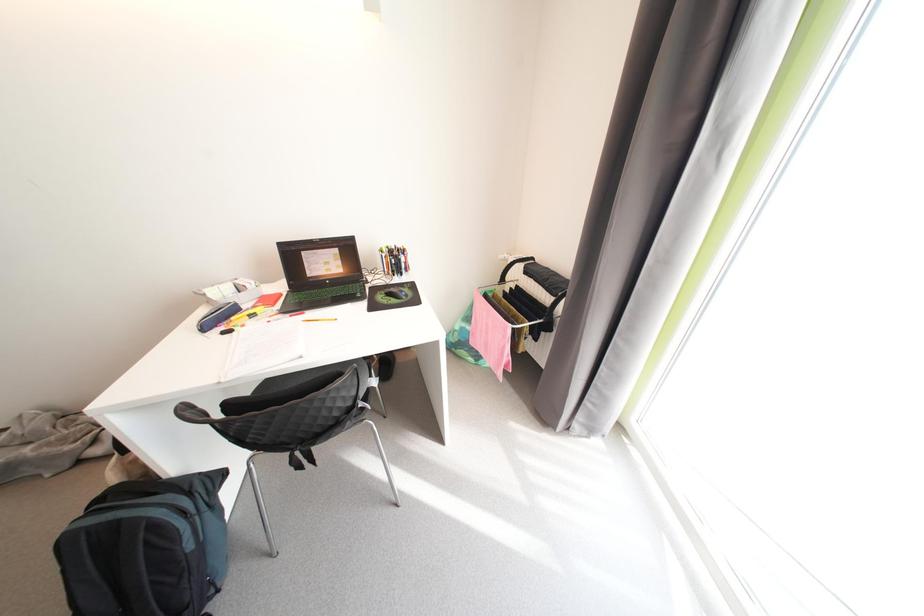
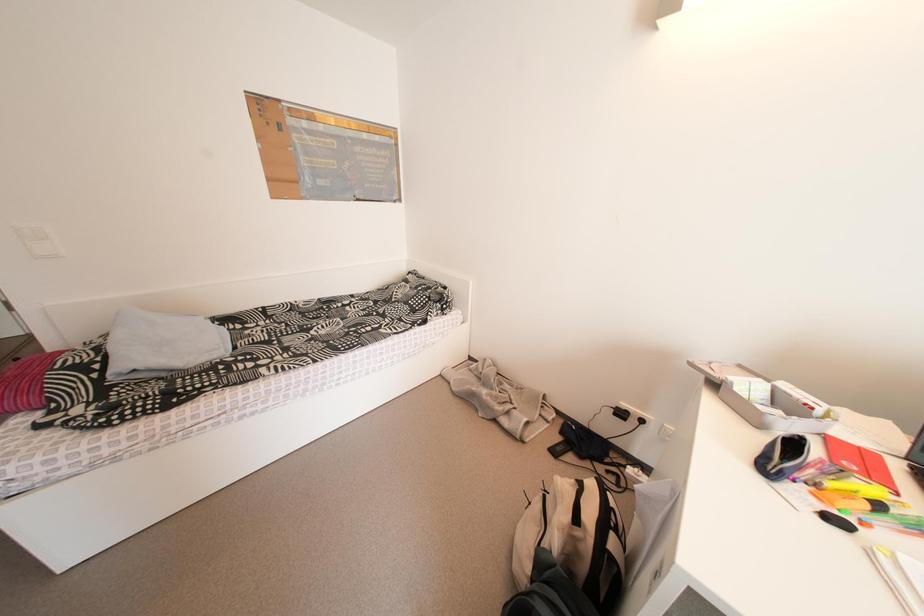
Question: The camera is either moving clockwise (left) or counter-clockwise (right) around the object. The first image is from the beginning of the video and the second image is from the end. Is the camera moving left or right when shooting the video?

Choices:
 (A) Left
 (B) Right

Answer: (B)